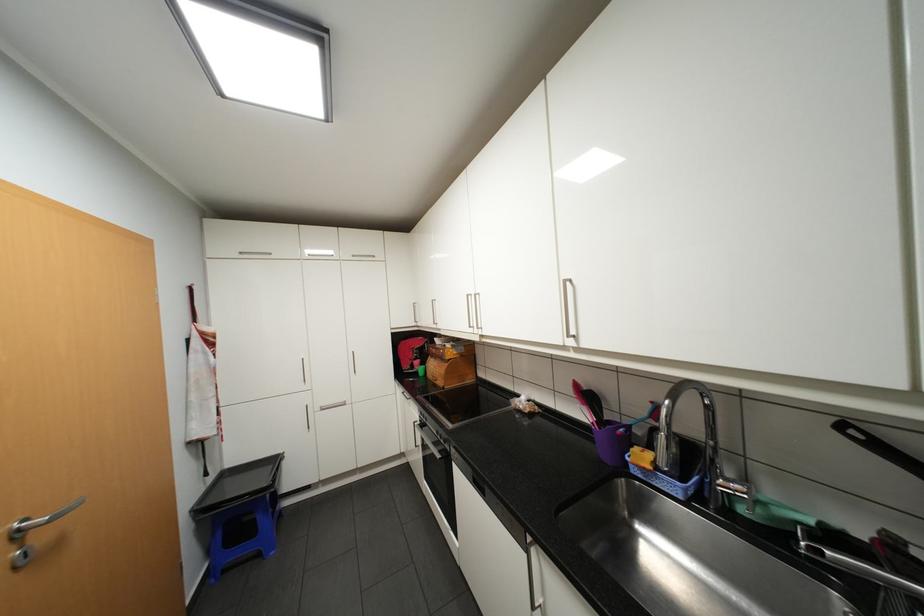
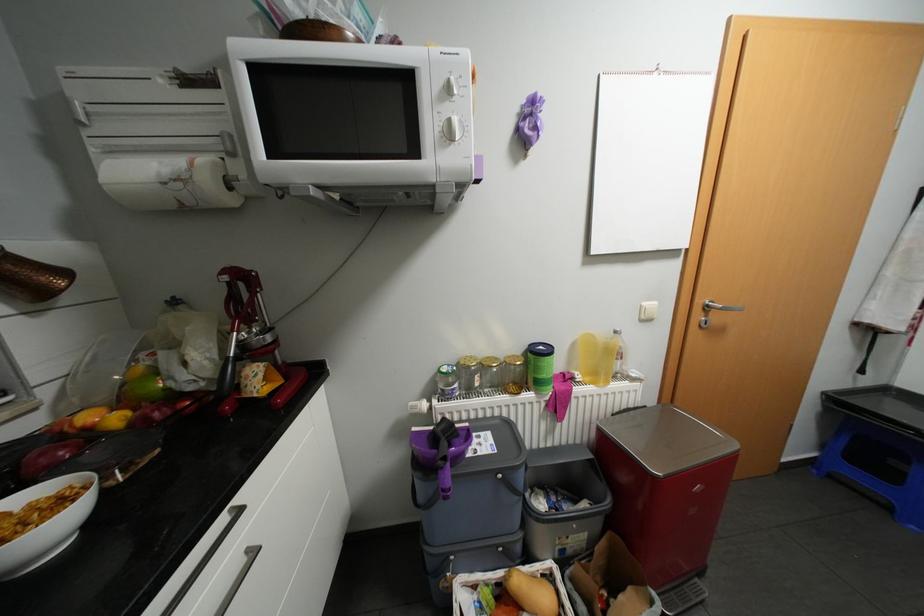
The images are taken continuously from a first-person perspective. In which direction is your viewpoint rotating?

The camera's rotation is toward left-down.